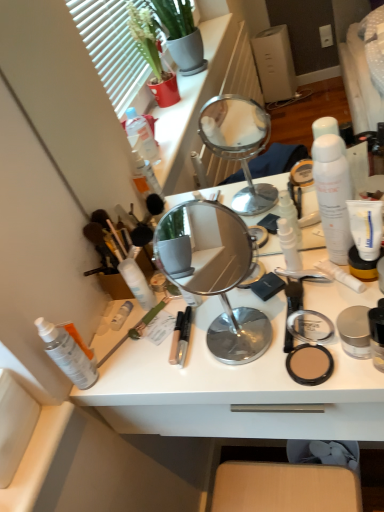
This screenshot has width=384, height=512. Describe the element at coordinates (340, 275) in the screenshot. I see `white matte tube at right, the first toothpaste when ordered from bottom to top` at that location.

The image size is (384, 512). Find the location of `white matte spray can at upper right, acting as the first toiletry starting from the right`. white matte spray can at upper right, acting as the first toiletry starting from the right is located at coordinates (333, 195).

Find the location of a particular element. The height and width of the screenshot is (512, 384). white matte spray can at center, which is the fourth toiletry in left-to-right order is located at coordinates (137, 283).

The width and height of the screenshot is (384, 512). Describe the element at coordinates (214, 273) in the screenshot. I see `polished silver mirror at center` at that location.

This screenshot has height=512, width=384. I want to click on white matte spray can at left, which ranks as the 2th toiletry in left-to-right order, so click(79, 341).

What's the angular difference between transparent plastic spray bottle at lower left, the 6th toiletry viewed from the right, and white plastic desk at center's facing directions?

The facing directions of transparent plastic spray bottle at lower left, the 6th toiletry viewed from the right, and white plastic desk at center are 2.18 degrees apart.

Image resolution: width=384 pixels, height=512 pixels. In order to click on desk on the right of transparent plastic spray bottle at lower left, the 1th toiletry from the left in this screenshot , I will do `click(235, 389)`.

Considering the relative positions of transparent plastic spray bottle at lower left, the 1th toiletry from the left, and white plastic desk at center in the image provided, is transparent plastic spray bottle at lower left, the 1th toiletry from the left, to the right of white plastic desk at center from the viewer's perspective?

In fact, transparent plastic spray bottle at lower left, the 1th toiletry from the left, is to the left of white plastic desk at center.

From the image's perspective, is transparent plastic spray bottle at lower left, the 6th toiletry viewed from the right, on top of white plastic desk at center?

Correct, transparent plastic spray bottle at lower left, the 6th toiletry viewed from the right, appears higher than white plastic desk at center in the image.

You are a GUI agent. You are given a task and a screenshot of the screen. Output one action in this format:
    pyautogui.click(x=<x>, y=<y>)
    Task: Click on the toiletry that is the 4th object to the right of the white matte spray can at left, marked as the fifth toiletry in a right-to-left arrangement, starting at the anchor
    The height and width of the screenshot is (512, 384).
    Given the screenshot: What is the action you would take?
    pyautogui.click(x=333, y=195)

From the image's perspective, between white matte spray can at left, which ranks as the 2th toiletry in left-to-right order, and white matte spray can at upper right, acting as the first toiletry starting from the right, which one is located above?

white matte spray can at upper right, acting as the first toiletry starting from the right, is shown above in the image.

Which object is closer to the camera, white matte spray can at left, marked as the fifth toiletry in a right-to-left arrangement, or white matte spray can at upper right, acting as the first toiletry starting from the right?

Positioned in front is white matte spray can at upper right, acting as the first toiletry starting from the right.

Can you see white matte spray can at left, which ranks as the 2th toiletry in left-to-right order, touching white matte spray can at upper right, acting as the first toiletry starting from the right?

There is a gap between white matte spray can at left, which ranks as the 2th toiletry in left-to-right order, and white matte spray can at upper right, acting as the first toiletry starting from the right.

This screenshot has height=512, width=384. What are the coordinates of `face powder above the white plastic desk at center (from a real-world perspective)` in the screenshot? It's located at (309, 364).

Can you confirm if white plastic desk at center is thinner than matte beige compact at right?

No, white plastic desk at center is not thinner than matte beige compact at right.

Consider the image. Is white plastic desk at center in front of or behind matte beige compact at right in the image?

In the image, white plastic desk at center appears in front of matte beige compact at right.

Which is in front, point (279, 307) or point (315, 352)?

The point (315, 352) is closer.

Considering the relative positions of green matte brush at center and polished silver mirror at center in the image provided, is green matte brush at center in front of polished silver mirror at center?

No, green matte brush at center is further to the viewer.

Measure the distance between green matte brush at center and polished silver mirror at center.

4.05 feet.

How different are the orientations of green matte brush at center and polished silver mirror at center in degrees?

There is a 34.4-degree angle between the facing directions of green matte brush at center and polished silver mirror at center.

Between green matte brush at center and polished silver mirror at center, which one has larger width?

green matte brush at center.

Are white matte spray can at left, marked as the fifth toiletry in a right-to-left arrangement, and white matte spray can at center, which is the fourth toiletry in left-to-right order, located far from each other?

white matte spray can at left, marked as the fifth toiletry in a right-to-left arrangement, is near white matte spray can at center, which is the fourth toiletry in left-to-right order, not far away.

This screenshot has width=384, height=512. Find the location of `the 1st toiletry located beneath the white matte spray can at center, which is the fourth toiletry in left-to-right order (from a real-world perspective)`. the 1st toiletry located beneath the white matte spray can at center, which is the fourth toiletry in left-to-right order (from a real-world perspective) is located at coordinates (79, 341).

Does white matte spray can at left, marked as the fifth toiletry in a right-to-left arrangement, have a lesser height compared to white matte spray can at center, which is the fourth toiletry in left-to-right order?

No.

Between white plastic desk at center and white matte lotion at center, which is counted as the 4th toiletry, starting from the right, which one appears on the left side from the viewer's perspective?

white matte lotion at center, which is counted as the 4th toiletry, starting from the right.

Is white plastic desk at center inside the boundaries of white matte lotion at center, which is counted as the 4th toiletry, starting from the right, or outside?

white plastic desk at center cannot be found inside white matte lotion at center, which is counted as the 4th toiletry, starting from the right.

Does white plastic desk at center have a greater width compared to white matte lotion at center, which is counted as the 4th toiletry, starting from the right?

Yes.

Is white plastic desk at center smaller than white matte lotion at center, which is counted as the 3th toiletry, starting from the left?

No.

Is white matte spray can at left, marked as the fifth toiletry in a right-to-left arrangement, not near white plastic desk at center?

white matte spray can at left, marked as the fifth toiletry in a right-to-left arrangement, is actually quite close to white plastic desk at center.

In the scene shown: How many degrees apart are the facing directions of white matte spray can at left, marked as the fifth toiletry in a right-to-left arrangement, and white plastic desk at center?

The facing directions of white matte spray can at left, marked as the fifth toiletry in a right-to-left arrangement, and white plastic desk at center are 2.18 degrees apart.

Could you tell me if white matte spray can at left, marked as the fifth toiletry in a right-to-left arrangement, is turned towards white plastic desk at center?

No, white matte spray can at left, marked as the fifth toiletry in a right-to-left arrangement, is not aimed at white plastic desk at center.

Find the location of a particular element. The width and height of the screenshot is (384, 512). desk lying on the right of transparent plastic spray bottle at lower left, the 1th toiletry from the left is located at coordinates (235, 389).

From a real-world perspective, count 4th toiletrys downward from the white matte spray can at upper right, the 6th toiletry viewed from the left, and point to it. Please provide its 2D coordinates.

[(79, 341)]

Estimate the real-world distances between objects in this image. Which object is further from matte beige compact at right, white plastic desk at center or transparent plastic spray bottle at lower left, the 6th toiletry viewed from the right?

transparent plastic spray bottle at lower left, the 6th toiletry viewed from the right.

From the image, which object appears to be nearer to polished silver mirror at center, transparent plastic spray bottle at lower left, the 1th toiletry from the left, or matte beige compact at right?

transparent plastic spray bottle at lower left, the 1th toiletry from the left, is positioned closer to the anchor polished silver mirror at center.

Which object lies nearer to the anchor point white matte lotion at center, which is counted as the 4th toiletry, starting from the right, matte beige compact at right or white matte spray can at upper right, acting as the first toiletry starting from the right?

matte beige compact at right.

From the image, which object appears to be farther from white matte spray can at upper right, the 6th toiletry viewed from the left, green matte brush at center or white matte tube at right, the second toothpaste ordered from the bottom?

Among the two, green matte brush at center is located further to white matte spray can at upper right, the 6th toiletry viewed from the left.

From the image, which object appears to be farther from white matte tube at right, the second toothpaste ordered from the bottom, white matte spray can at center, which is the fourth toiletry in left-to-right order, or white plastic desk at center?

white matte spray can at center, which is the fourth toiletry in left-to-right order.

Based on their spatial positions, is white matte lotion at center, acting as the 2th toiletry starting from the right, or white matte lotion at center, which is counted as the 3th toiletry, starting from the left, closer to white matte spray can at upper right, acting as the first toiletry starting from the right?

white matte lotion at center, acting as the 2th toiletry starting from the right, is positioned closer to the anchor white matte spray can at upper right, acting as the first toiletry starting from the right.

Considering their positions, is white matte lotion at center, which is counted as the 3th toiletry, starting from the left, positioned further to transparent plastic spray bottle at lower left, the 1th toiletry from the left, than white plastic desk at center?

white plastic desk at center.

Which object lies further to the anchor point white matte tube at right, acting as the first toothpaste starting from the top, white matte spray can at center, which is the third toiletry in right-to-left order, or white matte lotion at center, which is counted as the 4th toiletry, starting from the right?

The object further to white matte tube at right, acting as the first toothpaste starting from the top, is white matte lotion at center, which is counted as the 4th toiletry, starting from the right.

Where is `face powder located between transparent plastic spray bottle at lower left, the 6th toiletry viewed from the right, and white matte tube at right, the first toothpaste when ordered from bottom to top, in the left-right direction`? This screenshot has height=512, width=384. face powder located between transparent plastic spray bottle at lower left, the 6th toiletry viewed from the right, and white matte tube at right, the first toothpaste when ordered from bottom to top, in the left-right direction is located at coordinates [309, 364].

The image size is (384, 512). What are the coordinates of `mirror situated between white matte spray can at center, which is the fourth toiletry in left-to-right order, and white matte tube at right, the second toothpaste ordered from the bottom, from left to right` in the screenshot? It's located at (214, 273).

This screenshot has width=384, height=512. Find the location of `desk located between white matte spray can at center, which is the third toiletry in right-to-left order, and matte beige compact at right in the left-right direction`. desk located between white matte spray can at center, which is the third toiletry in right-to-left order, and matte beige compact at right in the left-right direction is located at coordinates (235, 389).

The height and width of the screenshot is (512, 384). In order to click on desk between transparent plastic spray bottle at lower left, the 1th toiletry from the left, and white matte tube at right, the second toothpaste viewed from the top, from left to right in this screenshot , I will do `click(235, 389)`.